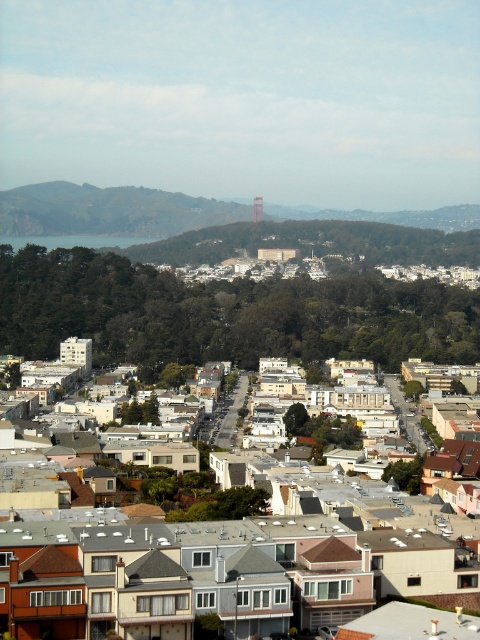
Consider the image. Between white matte houses at center and orange metallic bridge at center, which one has less height?

With less height is white matte houses at center.

I want to click on white matte houses at center, so click(x=183, y=577).